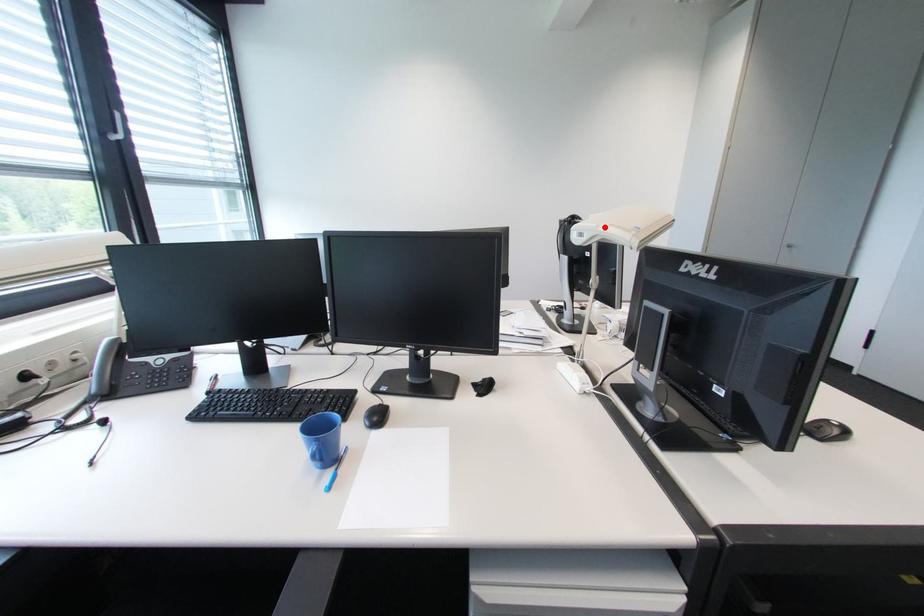
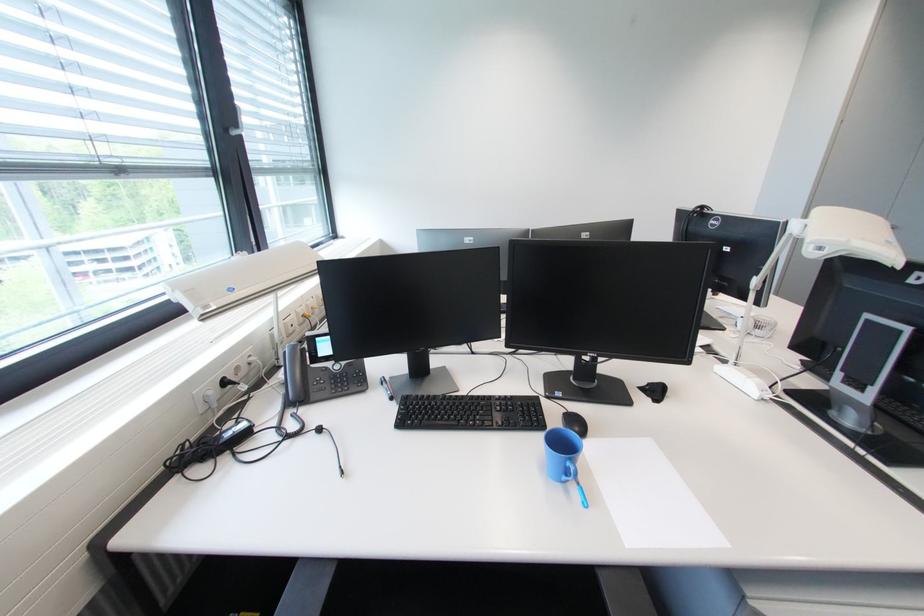
Question: A red point is marked in image1. In image2, is the corresponding 3D point closer to the camera or farther? Reply with the corresponding letter.

Choices:
 (A) The corresponding 3D point is closer.
 (B) The corresponding 3D point is farther.

Answer: (A)